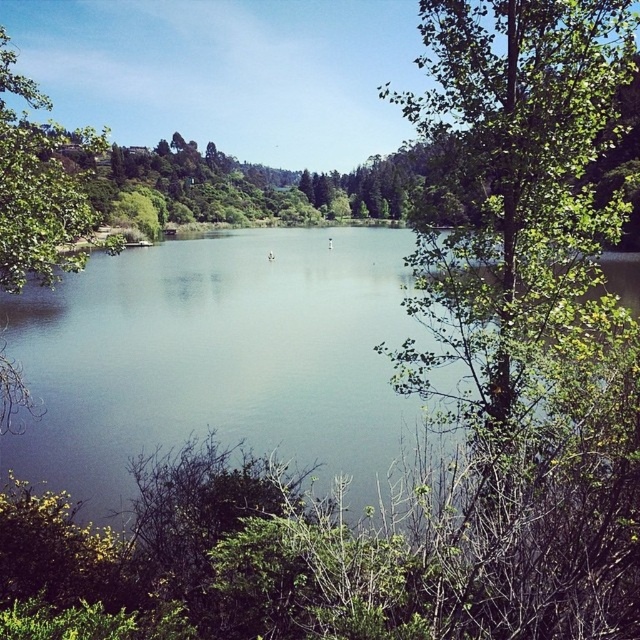
How far apart are clear water at center and green leafy tree at right?

clear water at center and green leafy tree at right are 18.47 meters apart.

Image resolution: width=640 pixels, height=640 pixels. Identify the location of clear water at center. (216, 358).

Between green leafy tree at right and green leafy tree at upper left, which one appears on the right side from the viewer's perspective?

Positioned to the right is green leafy tree at right.

This screenshot has height=640, width=640. Identify the location of green leafy tree at right. (513, 189).

Locate an element on the screen. The width and height of the screenshot is (640, 640). green leafy tree at right is located at coordinates [x=513, y=189].

Who is shorter, clear water at center or green leafy tree at upper left?

With less height is clear water at center.

Is clear water at center positioned in front of green leafy tree at upper left?

Yes, it is in front of green leafy tree at upper left.

The image size is (640, 640). Describe the element at coordinates (216, 358) in the screenshot. I see `clear water at center` at that location.

The image size is (640, 640). Identify the location of clear water at center. (216, 358).